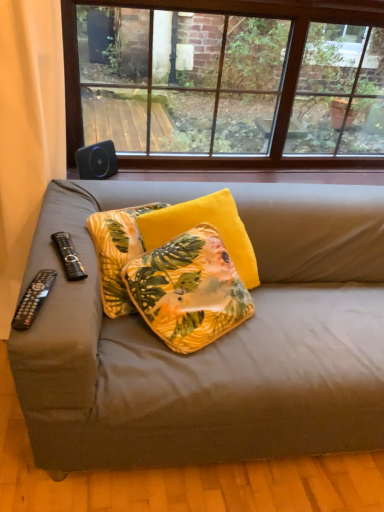
At what (x,y) coordinates should I click in order to perform the action: click on vacant region to the left of black plastic remote at left, placed as the second remote control when sorted from bottom to top. Please return your answer as a coordinate pair (x, y). This screenshot has width=384, height=512. Looking at the image, I should click on (41, 250).